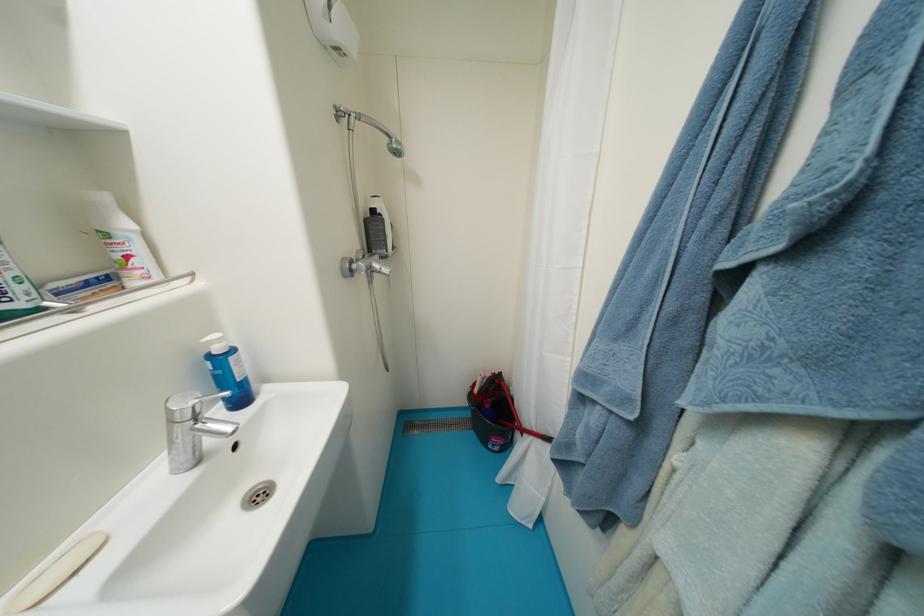
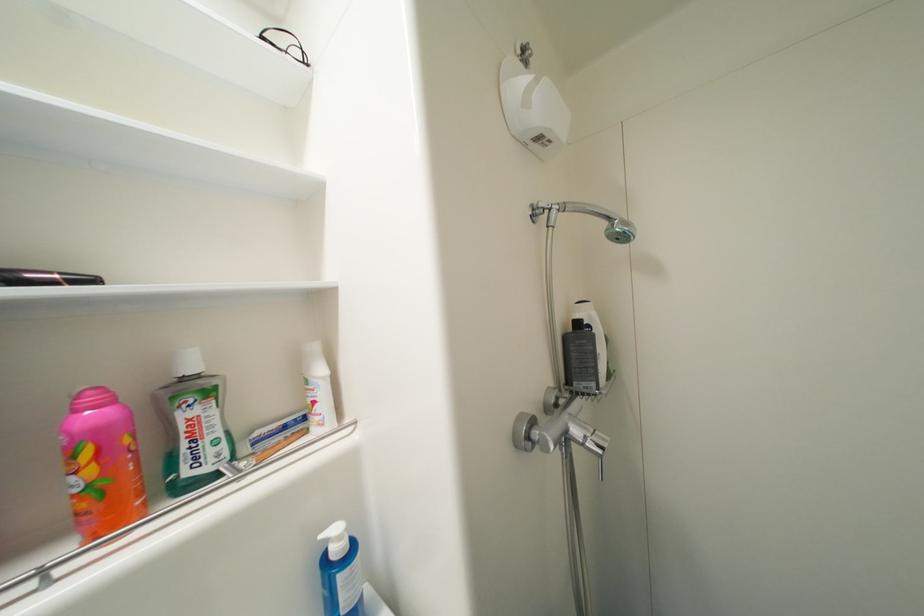
Question: The first image is from the beginning of the video and the second image is from the end. How did the camera likely rotate when shooting the video?

Choices:
 (A) Left
 (B) Right
 (C) Up
 (D) Down

Answer: (A)